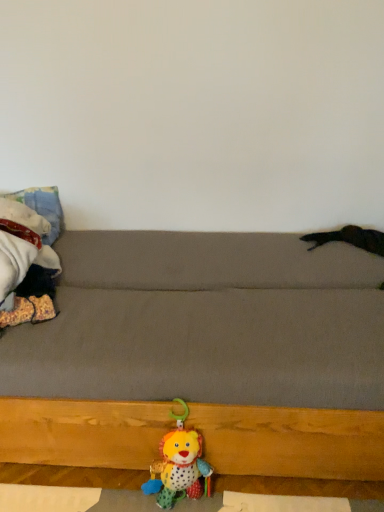
Question: Is gray fabric couch at center outside fluffy fabric blanket at left, which is the 2th toy in right-to-left order?

Choices:
 (A) yes
 (B) no

Answer: (A)

Question: Considering the relative sizes of gray fabric couch at center and fluffy fabric blanket at left, marked as the 1th toy in a left-to-right arrangement, in the image provided, is gray fabric couch at center taller than fluffy fabric blanket at left, marked as the 1th toy in a left-to-right arrangement,?

Choices:
 (A) no
 (B) yes

Answer: (B)

Question: Is gray fabric couch at center thinner than fluffy fabric blanket at left, which is the 2th toy in right-to-left order?

Choices:
 (A) no
 (B) yes

Answer: (A)

Question: Is gray fabric couch at center at the right side of fluffy fabric blanket at left, which is the 2th toy in right-to-left order?

Choices:
 (A) no
 (B) yes

Answer: (B)

Question: Is gray fabric couch at center in front of fluffy fabric blanket at left, the 1th toy when ordered from top to bottom?

Choices:
 (A) yes
 (B) no

Answer: (A)

Question: From the image's perspective, is gray fabric couch at center above or below soft plush lion at lower center, which is the 1th toy in right-to-left order?

Choices:
 (A) below
 (B) above

Answer: (B)

Question: Is gray fabric couch at center spatially inside soft plush lion at lower center, which ranks as the second toy in top-to-bottom order, or outside of it?

Choices:
 (A) inside
 (B) outside

Answer: (B)

Question: Is point (357, 367) positioned closer to the camera than point (173, 496)?

Choices:
 (A) closer
 (B) farther

Answer: (A)

Question: From their relative heights in the image, would you say gray fabric couch at center is taller or shorter than soft plush lion at lower center, which ranks as the second toy in top-to-bottom order?

Choices:
 (A) tall
 (B) short

Answer: (A)

Question: Is point (36, 285) positioned closer to the camera than point (241, 448)?

Choices:
 (A) farther
 (B) closer

Answer: (A)

Question: From a real-world perspective, relative to gray fabric couch at center, is fluffy fabric blanket at left, the 1th toy when ordered from top to bottom, vertically above or below?

Choices:
 (A) above
 (B) below

Answer: (A)

Question: From their relative heights in the image, would you say fluffy fabric blanket at left, the 1th toy when ordered from top to bottom, is taller or shorter than gray fabric couch at center?

Choices:
 (A) short
 (B) tall

Answer: (A)

Question: Considering the positions of fluffy fabric blanket at left, which is the 2th toy in right-to-left order, and gray fabric couch at center in the image, is fluffy fabric blanket at left, which is the 2th toy in right-to-left order, bigger or smaller than gray fabric couch at center?

Choices:
 (A) small
 (B) big

Answer: (A)

Question: Is point (185, 433) closer or farther from the camera than point (135, 393)?

Choices:
 (A) farther
 (B) closer

Answer: (A)

Question: From a real-world perspective, relative to gray fabric couch at center, is soft plush lion at lower center, which ranks as the first toy in bottom-to-top order, vertically above or below?

Choices:
 (A) above
 (B) below

Answer: (B)